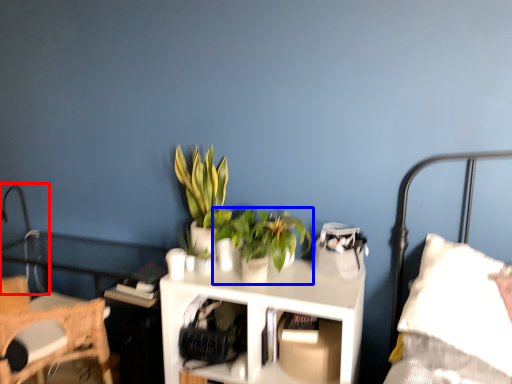
Question: Which object is further to the camera taking this photo, table lamp (highlighted by a red box) or houseplant (highlighted by a blue box)?

Choices:
 (A) table lamp
 (B) houseplant

Answer: (A)